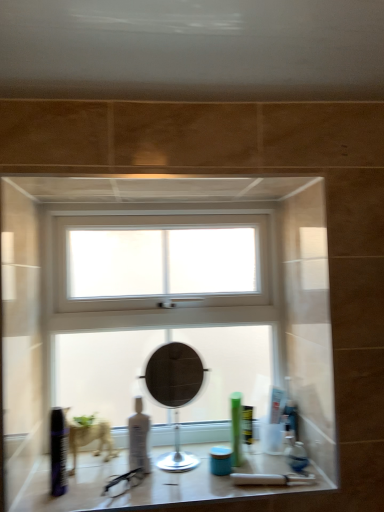
Identify the location of unoccupied space behind shiny black can at lower left, positioned as the first toiletry in left-to-right order. (82, 477).